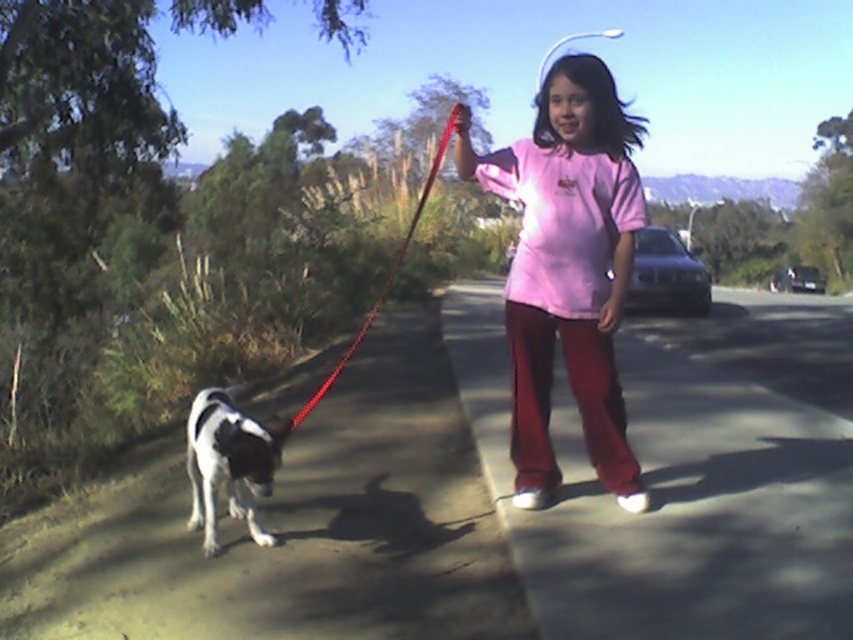
You are the girl in the scene. You want to step onto the smooth concrete path at lower left to avoid the sun. Can you step there without moving the red nylon leash at center?

The smooth concrete path at lower left is positioned under the red nylon leash at center, so stepping onto it would not interfere with the leash as it is already above the path.

You are standing on the path and looking towards the road. Which object is closer to you, the smooth asphalt road at center or the red nylon leash at center?

The red nylon leash at center is closer to you because the smooth asphalt road at center is further away.

You are a pedestrian crossing the road. You see the smooth asphalt road at center and the black and white fur at lower left. Which object is closer to you?

The black and white fur at lower left is behind the smooth asphalt road at center, so the smooth asphalt road at center is closer to you.